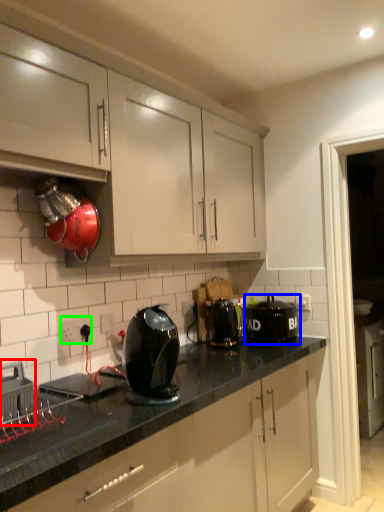
Question: Considering the real-world distances, which object is farthest from home appliance (highlighted by a red box)? kitchen appliance (highlighted by a blue box) or electric outlet (highlighted by a green box)?

Choices:
 (A) kitchen appliance
 (B) electric outlet

Answer: (A)